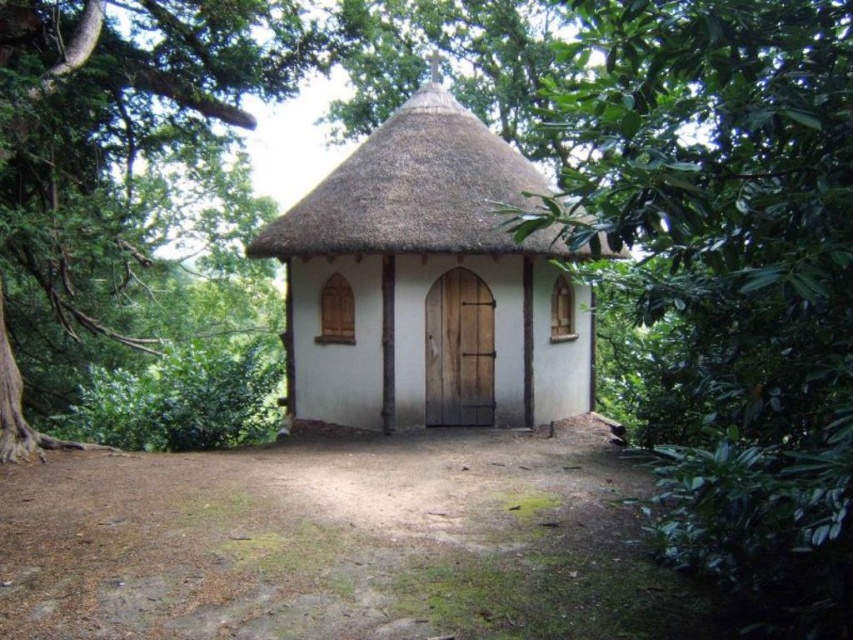
Looking at this image, you are standing in the forest and see the white wooden cottage at center. If you want to reach the cottage, which direction should you walk relative to your current position?

The white wooden cottage at center is located at point coordinates, so you should walk towards the center of the image to reach it.

You are standing in front of the rustic chapel and want to walk towards the green leafy tree at center. Which direction should you move to get closer to it while avoiding the green leafy tree at left?

The green leafy tree at center is closer to the viewer than the green leafy tree at left, so you should move forward towards the tree at center while staying to the right to avoid the tree at left.

You are standing in a forest and see a green leafy tree at center and a white wooden cottage at center. Which one is more to the right?

The green leafy tree at center is more to the right because it is positioned on the right side of the white wooden cottage at center.